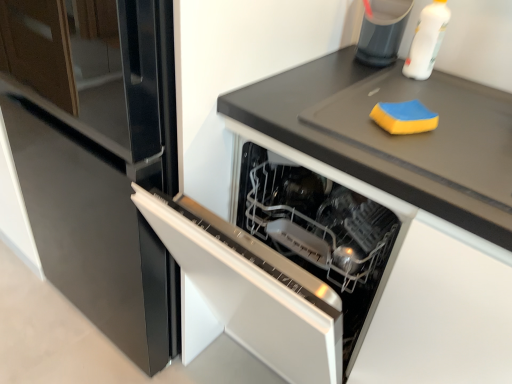
This screenshot has width=512, height=384. Find the location of `free space in front of yellow sponge at upper right`. free space in front of yellow sponge at upper right is located at coordinates (436, 152).